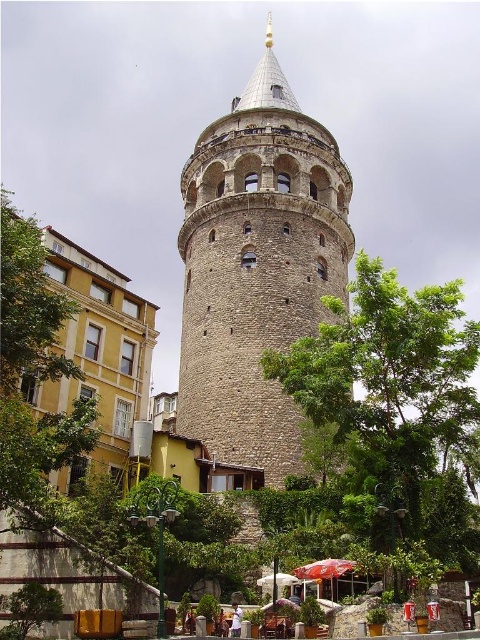
You are a tourist standing at the base of the brown stone tower at center and want to take a photo of the green leafy tree at lower left. Can you see the tree clearly without any obstruction from the tower?

The green leafy tree at lower left is behind the brown stone tower at center, so you cannot see it clearly from the base of the tower as it would be obstructed by the tower itself.

You are a tourist standing in front of the brown stone tower at center and want to take a photo of the red fabric umbrella at lower center. Which object should you focus on first to ensure both are in the frame?

You should focus on the brown stone tower at center first because it might be wider than the red fabric umbrella at lower center, so centering it ensures both fit in the frame.